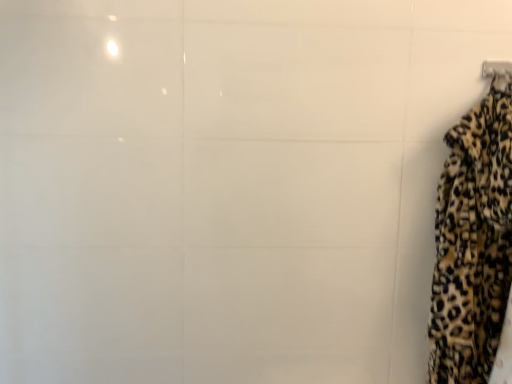
This screenshot has width=512, height=384. In order to click on leopard print fabric at right in this screenshot , I will do `click(473, 242)`.

Describe the element at coordinates (473, 242) in the screenshot. I see `leopard print fabric at right` at that location.

Measure the distance between point [506,64] and camera.

They are 1.28 meters apart.

Measure the distance between metallic silver hanger at upper right and camera.

metallic silver hanger at upper right and camera are 1.15 meters apart.

Find the location of a particular element. metallic silver hanger at upper right is located at coordinates (496, 68).

Describe the element at coordinates (496, 68) in the screenshot. I see `metallic silver hanger at upper right` at that location.

This screenshot has height=384, width=512. Find the location of `leopard print fabric at right`. leopard print fabric at right is located at coordinates (473, 242).

Considering the positions of objects leopard print fabric at right and metallic silver hanger at upper right in the image provided, who is more to the right, leopard print fabric at right or metallic silver hanger at upper right?

Positioned to the right is metallic silver hanger at upper right.

Does leopard print fabric at right lie behind metallic silver hanger at upper right?

That is False.

Between point (449, 270) and point (498, 71), which one is positioned behind?

Point (498, 71)

From the image's perspective, is leopard print fabric at right positioned above or below metallic silver hanger at upper right?

Clearly, from the image's perspective, leopard print fabric at right is below metallic silver hanger at upper right.

From a real-world perspective, is leopard print fabric at right above or below metallic silver hanger at upper right?

leopard print fabric at right is below metallic silver hanger at upper right.

Considering the sizes of objects leopard print fabric at right and metallic silver hanger at upper right in the image provided, who is thinner, leopard print fabric at right or metallic silver hanger at upper right?

With smaller width is metallic silver hanger at upper right.

Is leopard print fabric at right taller than metallic silver hanger at upper right?

Yes, leopard print fabric at right is taller than metallic silver hanger at upper right.

Can you confirm if leopard print fabric at right is smaller than metallic silver hanger at upper right?

Actually, leopard print fabric at right might be larger than metallic silver hanger at upper right.

Is metallic silver hanger at upper right inside leopard print fabric at right?

Yes, leopard print fabric at right contains metallic silver hanger at upper right.

Would you say leopard print fabric at right is a long distance from metallic silver hanger at upper right?

That's not correct — leopard print fabric at right is a little close to metallic silver hanger at upper right.

Is metallic silver hanger at upper right at the back of leopard print fabric at right?

Yes, leopard print fabric at right is facing away from metallic silver hanger at upper right.

How distant is leopard print fabric at right from metallic silver hanger at upper right?

A distance of 17.03 inches exists between leopard print fabric at right and metallic silver hanger at upper right.

This screenshot has width=512, height=384. In the image, there is a metallic silver hanger at upper right. Find the location of `curtain below it (from the image's perspective)`. curtain below it (from the image's perspective) is located at coordinates (473, 242).

Visually, is metallic silver hanger at upper right positioned to the left or to the right of leopard print fabric at right?

metallic silver hanger at upper right is to the right of leopard print fabric at right.

Which is behind, metallic silver hanger at upper right or leopard print fabric at right?

metallic silver hanger at upper right.

Is point (486, 71) more distant than point (441, 204)?

Yes, point (486, 71) is farther from viewer.

From the image's perspective, is metallic silver hanger at upper right on top of leopard print fabric at right?

Indeed, from the image's perspective, metallic silver hanger at upper right is shown above leopard print fabric at right.

From a real-world perspective, is metallic silver hanger at upper right above or below leopard print fabric at right?

metallic silver hanger at upper right is situated higher than leopard print fabric at right in the real world.

Considering the sizes of metallic silver hanger at upper right and leopard print fabric at right in the image, is metallic silver hanger at upper right wider or thinner than leopard print fabric at right?

Considering their sizes, metallic silver hanger at upper right looks slimmer than leopard print fabric at right.

Is metallic silver hanger at upper right taller or shorter than leopard print fabric at right?

Clearly, metallic silver hanger at upper right is shorter compared to leopard print fabric at right.

Does metallic silver hanger at upper right have a larger size compared to leopard print fabric at right?

No, metallic silver hanger at upper right is not bigger than leopard print fabric at right.

Is metallic silver hanger at upper right located outside leopard print fabric at right?

No, metallic silver hanger at upper right is not outside of leopard print fabric at right.

Are metallic silver hanger at upper right and leopard print fabric at right beside each other?

There is a gap between metallic silver hanger at upper right and leopard print fabric at right.

Could you tell me if metallic silver hanger at upper right is turned towards leopard print fabric at right?

Yes, metallic silver hanger at upper right is oriented towards leopard print fabric at right.

Can you tell me how much metallic silver hanger at upper right and leopard print fabric at right differ in facing direction?

0.199 degrees.

At what (x,y) coordinates should I click in order to perform the action: click on curtain that is in front of the metallic silver hanger at upper right. Please return your answer as a coordinate pair (x, y). Looking at the image, I should click on (473, 242).

Locate an element on the screen. hanger behind the leopard print fabric at right is located at coordinates (496, 68).

The height and width of the screenshot is (384, 512). Identify the location of curtain below the metallic silver hanger at upper right (from a real-world perspective). (473, 242).